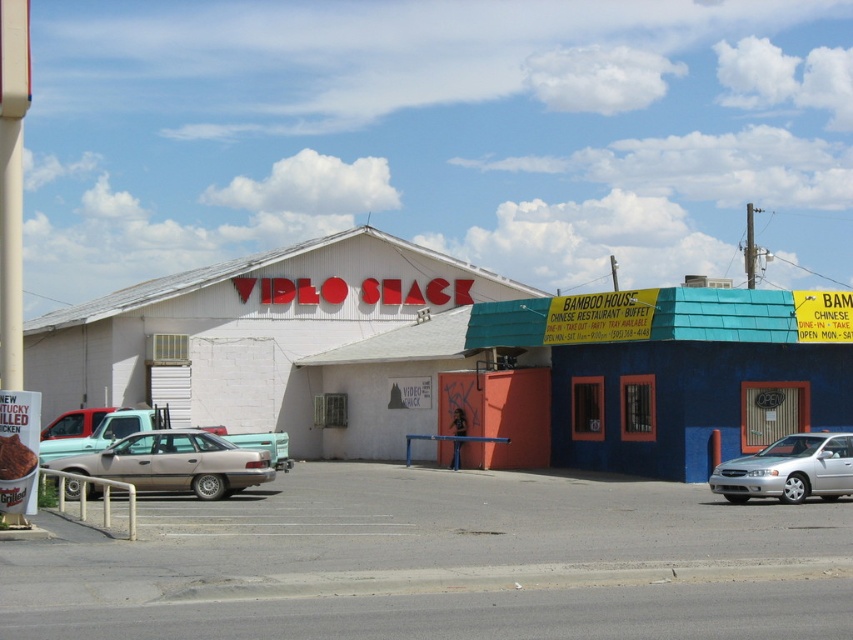
Question: Which object appears closest to the camera in this image?

Choices:
 (A) matte gray sedan at center-left
 (B) silver metallic sedan at right

Answer: (B)

Question: Is matte gray sedan at center-left below silver metallic sedan at right?

Choices:
 (A) yes
 (B) no

Answer: (B)

Question: Can you confirm if matte gray sedan at center-left is positioned to the left of silver metallic sedan at center-left?

Choices:
 (A) yes
 (B) no

Answer: (B)

Question: Does matte gray sedan at center-left have a smaller size compared to silver metallic sedan at right?

Choices:
 (A) no
 (B) yes

Answer: (A)

Question: Which of the following is the farthest from the observer?

Choices:
 (A) (822, 460)
 (B) (764, 554)

Answer: (A)

Question: Which of these objects is positioned farthest from the matte gray sedan at center-left?

Choices:
 (A) silver metallic sedan at right
 (B) silver metallic sedan at center-left
 (C) gray asphalt parking lot at center

Answer: (A)